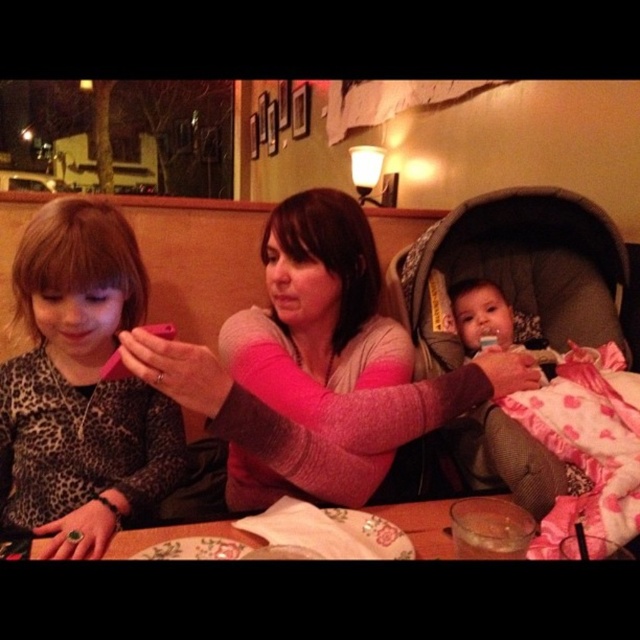
Is pink sweater at center bigger than dark gray fabric baby carriage at right?

Indeed, pink sweater at center has a larger size compared to dark gray fabric baby carriage at right.

The width and height of the screenshot is (640, 640). What do you see at coordinates (316, 365) in the screenshot? I see `pink sweater at center` at bounding box center [316, 365].

Is point (275, 221) positioned in front of point (509, 250)?

Yes, it is.

This screenshot has width=640, height=640. Identify the location of pink sweater at center. (316, 365).

Who is more distant from viewer, (380,461) or (44,493)?

The point (44,493) is behind.

Does pink sweater at center come in front of leopard print sweater at left?

Yes, pink sweater at center is closer to the viewer.

Who is more forward, (145, 371) or (42, 218)?

Point (145, 371) is more forward.

Locate an element on the screen. The image size is (640, 640). pink sweater at center is located at coordinates (316, 365).

Which is below, dark gray fabric baby carriage at right or leopard print sweater at left?

Positioned lower is leopard print sweater at left.

Between point (545, 538) and point (12, 362), which one is positioned in front?

Point (545, 538)

Which is behind, point (605, 492) or point (44, 516)?

Point (44, 516)

The width and height of the screenshot is (640, 640). Identify the location of dark gray fabric baby carriage at right. (545, 348).